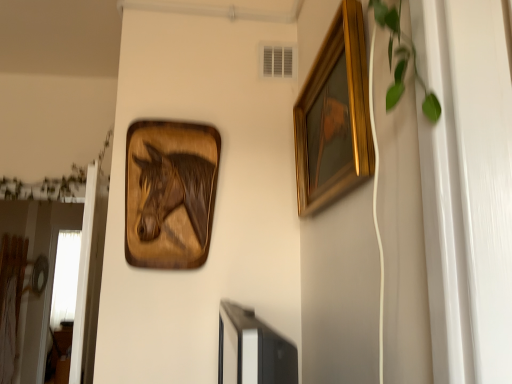
Image resolution: width=512 pixels, height=384 pixels. Describe the element at coordinates (402, 59) in the screenshot. I see `green leafy plant at upper right` at that location.

Where is `green leafy plant at upper right`? green leafy plant at upper right is located at coordinates (402, 59).

Between point (395, 36) and point (202, 232), which one is positioned in front?

Positioned in front is point (395, 36).

At what (x,y) coordinates should I click in order to perform the action: click on plant located on the right of wooden horse at upper left. Please return your answer as a coordinate pair (x, y). The image size is (512, 384). Looking at the image, I should click on (402, 59).

From the image's perspective, is green leafy plant at upper right above wooden horse at upper left?

Yes, from the image's perspective, green leafy plant at upper right is above wooden horse at upper left.

Between gold wooden picture frame at upper right and green leafy plant at upper right, which one has larger size?

gold wooden picture frame at upper right is bigger.

Is gold wooden picture frame at upper right oriented towards green leafy plant at upper right?

No.

From the image's perspective, is gold wooden picture frame at upper right located above or below green leafy plant at upper right?

Clearly, from the image's perspective, gold wooden picture frame at upper right is below green leafy plant at upper right.

At what (x,y) coordinates should I click in order to perform the action: click on plant that appears in front of the gold wooden picture frame at upper right. Please return your answer as a coordinate pair (x, y). The width and height of the screenshot is (512, 384). Looking at the image, I should click on (402, 59).

Can you tell me how much gold wooden picture frame at upper right and wooden horse at upper left differ in facing direction?

gold wooden picture frame at upper right and wooden horse at upper left are facing 88.6 degrees away from each other.

In the scene shown: Which point is more forward, (359, 72) or (204, 216)?

The point (359, 72) is more forward.

From the image's perspective, between gold wooden picture frame at upper right and wooden horse at upper left, which one is located above?

gold wooden picture frame at upper right is shown above in the image.

Would you say wooden horse at upper left is outside gold wooden picture frame at upper right?

Yes.

Is wooden horse at upper left oriented towards gold wooden picture frame at upper right?

No, wooden horse at upper left does not turn towards gold wooden picture frame at upper right.

Considering the sizes of objects wooden horse at upper left and gold wooden picture frame at upper right in the image provided, who is smaller, wooden horse at upper left or gold wooden picture frame at upper right?

wooden horse at upper left is smaller.

Does point (192, 168) appear closer or farther from the camera than point (300, 126)?

Point (192, 168) appears to be farther away from the viewer than point (300, 126).

Considering the relative positions of green leafy plant at upper right and gold wooden picture frame at upper right in the image provided, is green leafy plant at upper right to the left of gold wooden picture frame at upper right from the viewer's perspective?

No.

Which is in front, green leafy plant at upper right or gold wooden picture frame at upper right?

green leafy plant at upper right is closer to the camera.

Find the location of a particular element. The height and width of the screenshot is (384, 512). plant above the gold wooden picture frame at upper right (from a real-world perspective) is located at coordinates 402,59.

You are a GUI agent. You are given a task and a screenshot of the screen. Output one action in this format:
    pyautogui.click(x=<x>, y=<y>)
    Task: Click on the plant above the wooden horse at upper left (from the image's perspective)
    This screenshot has height=384, width=512.
    Given the screenshot: What is the action you would take?
    pyautogui.click(x=402, y=59)

Considering the relative sizes of wooden horse at upper left and green leafy plant at upper right in the image provided, is wooden horse at upper left bigger than green leafy plant at upper right?

Indeed, wooden horse at upper left has a larger size compared to green leafy plant at upper right.

Is wooden horse at upper left taller or shorter than green leafy plant at upper right?

Considering their sizes, wooden horse at upper left has more height than green leafy plant at upper right.

Consider the image. From a real-world perspective, is wooden horse at upper left beneath green leafy plant at upper right?

Indeed, from a real-world perspective, wooden horse at upper left is positioned beneath green leafy plant at upper right.

The height and width of the screenshot is (384, 512). In order to click on animal on the left of green leafy plant at upper right in this screenshot , I will do `click(174, 191)`.

I want to click on picture frame below the green leafy plant at upper right (from the image's perspective), so click(x=336, y=111).

Estimate the real-world distances between objects in this image. Which object is closer to green leafy plant at upper right, gold wooden picture frame at upper right or wooden horse at upper left?

gold wooden picture frame at upper right is positioned closer to the anchor green leafy plant at upper right.

Looking at the image, which one is located closer to gold wooden picture frame at upper right, wooden horse at upper left or green leafy plant at upper right?

Among the two, green leafy plant at upper right is located nearer to gold wooden picture frame at upper right.

Estimate the real-world distances between objects in this image. Which object is further from gold wooden picture frame at upper right, green leafy plant at upper right or wooden horse at upper left?

wooden horse at upper left is further to gold wooden picture frame at upper right.

Considering their positions, is green leafy plant at upper right positioned further to wooden horse at upper left than gold wooden picture frame at upper right?

Among the two, green leafy plant at upper right is located further to wooden horse at upper left.

When comparing their distances from green leafy plant at upper right, does wooden horse at upper left or gold wooden picture frame at upper right seem further?

wooden horse at upper left is further to green leafy plant at upper right.

When comparing their distances from wooden horse at upper left, does gold wooden picture frame at upper right or green leafy plant at upper right seem closer?

Among the two, gold wooden picture frame at upper right is located nearer to wooden horse at upper left.

What are the coordinates of `picture frame between green leafy plant at upper right and wooden horse at upper left along the z-axis` in the screenshot? It's located at (336, 111).